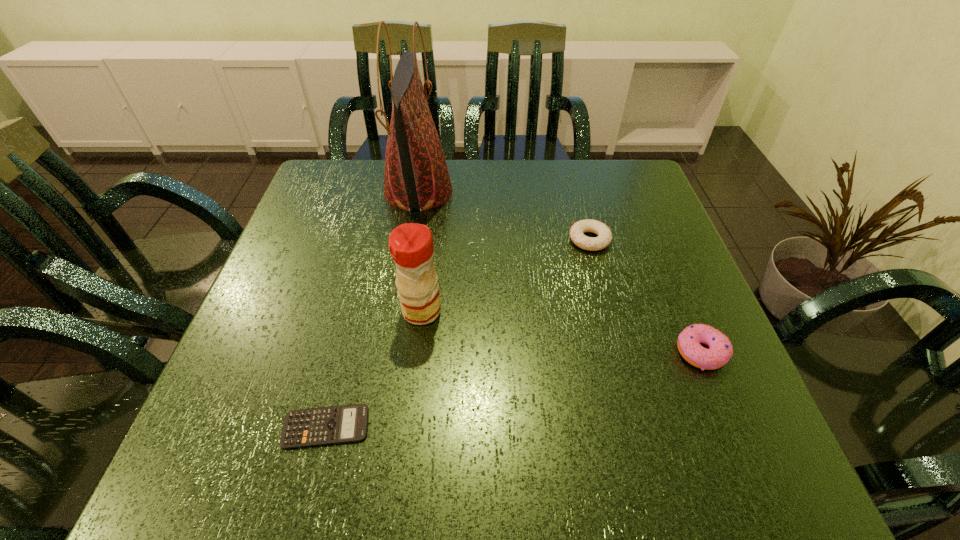
The height and width of the screenshot is (540, 960). What are the coordinates of `vacant space positioned on the left of the farthest object` in the screenshot? It's located at (347, 191).

I want to click on vacant region located on the right of the third nearest object, so click(x=620, y=311).

Locate an element on the screen. free space located on the left of the right doughnut is located at coordinates (519, 352).

You are a GUI agent. You are given a task and a screenshot of the screen. Output one action in this format:
    pyautogui.click(x=<x>, y=<y>)
    Task: Click on the free spot located on the front of the farther doughnut
    
    Given the screenshot: What is the action you would take?
    pyautogui.click(x=613, y=332)

Locate an element on the screen. The image size is (960, 540). free space located 0.080m on the right of the nearest object is located at coordinates (418, 427).

I want to click on object located in the far edge section of the desktop, so 416,176.

The height and width of the screenshot is (540, 960). In order to click on object positioned at the near edge in this screenshot , I will do `click(348, 423)`.

Locate an element on the screen. The image size is (960, 540). object located at the left edge is located at coordinates (348, 423).

Where is `object at the near left corner`? This screenshot has height=540, width=960. object at the near left corner is located at coordinates (348, 423).

At what (x,y) coordinates should I click in order to perform the action: click on vacant space at the far edge. Please return your answer as a coordinate pair (x, y). Image resolution: width=960 pixels, height=540 pixels. Looking at the image, I should click on (586, 193).